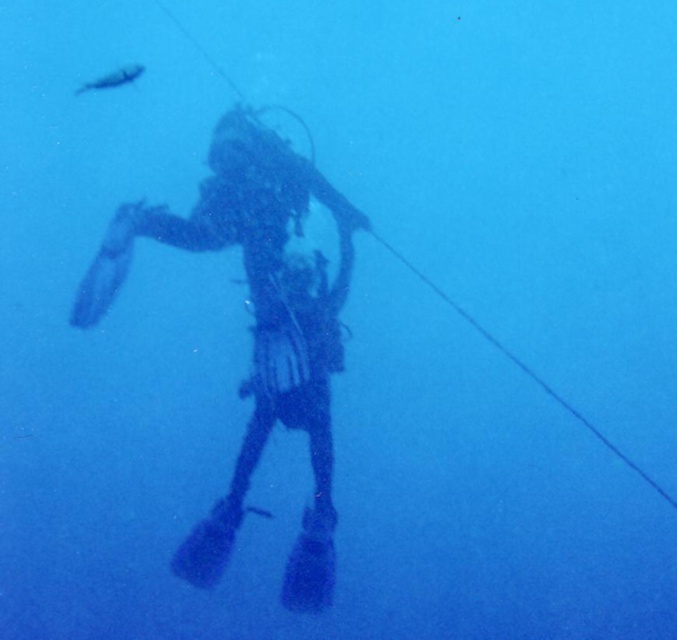
Question: Is translucent blue fin at center wider than shiny silver fish at upper left?

Choices:
 (A) no
 (B) yes

Answer: (A)

Question: Which object appears closest to the camera in this image?

Choices:
 (A) black matte scuba diver at center
 (B) shiny silver fish at upper left
 (C) translucent blue fin at center

Answer: (B)

Question: Which point appears farthest from the camera in this image?

Choices:
 (A) (234, 500)
 (B) (89, 260)

Answer: (B)

Question: Does translucent blue fin at center appear under shiny silver fish at upper left?

Choices:
 (A) no
 (B) yes

Answer: (B)

Question: Is black matte scuba diver at center bigger than translucent blue fin at center?

Choices:
 (A) yes
 (B) no

Answer: (A)

Question: Which point appears closest to the camera in this image?

Choices:
 (A) (313, 378)
 (B) (100, 241)
 (C) (112, 77)

Answer: (A)